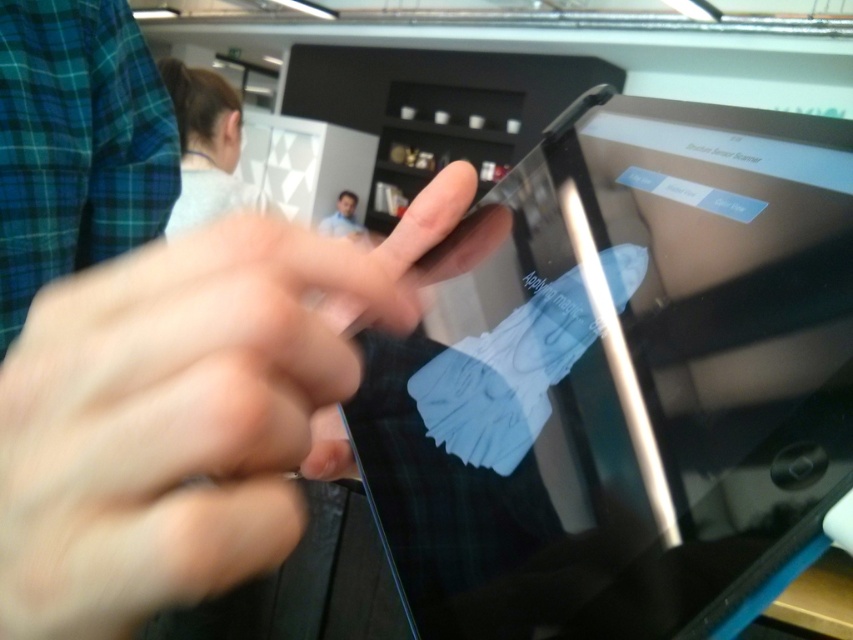
You are designing a layout for a digital interface and need to ensure that the black glossy tablet at center and the blue matte face at upper center are positioned correctly. Based on the scene, which object should be placed lower to maintain proper alignment?

The black glossy tablet at center should be placed lower than the blue matte face at upper center since it is not as tall as the blue matte face at upper center.

Looking at this image, you are taking a photo of the touchscreen device and want to focus on both the point at coordinates point (498, 406) and point (294, 458). Which point should you focus on to ensure both are in focus?

You should focus on point (498, 406) because it is closer to the camera than point (294, 458). By focusing on the closer point, the depth of field may allow the farther point to also be in focus.

You are a security guard checking the distance between the black glossy tablet at center and the blue matte face at upper center. Which object is nearer to you?

The black glossy tablet at center is closer to the viewer than the blue matte face at upper center.